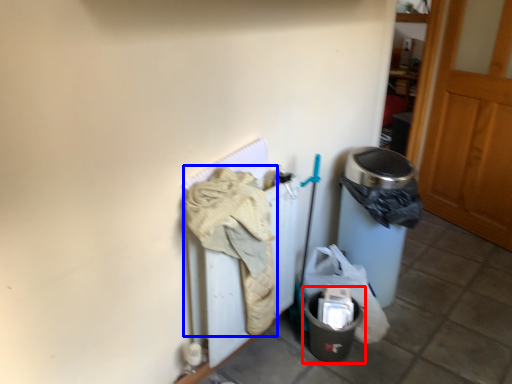
Question: Which object is closer to the camera taking this photo, recycling bin (highlighted by a red box) or clothing (highlighted by a blue box)?

Choices:
 (A) recycling bin
 (B) clothing

Answer: (B)